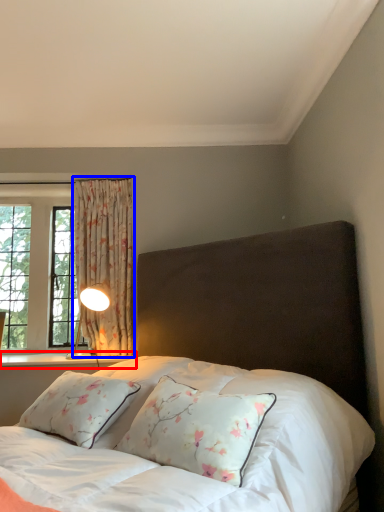
Question: Which of the following is the closest to the observer, window sill (highlighted by a red box) or curtain (highlighted by a blue box)?

Choices:
 (A) window sill
 (B) curtain

Answer: (A)